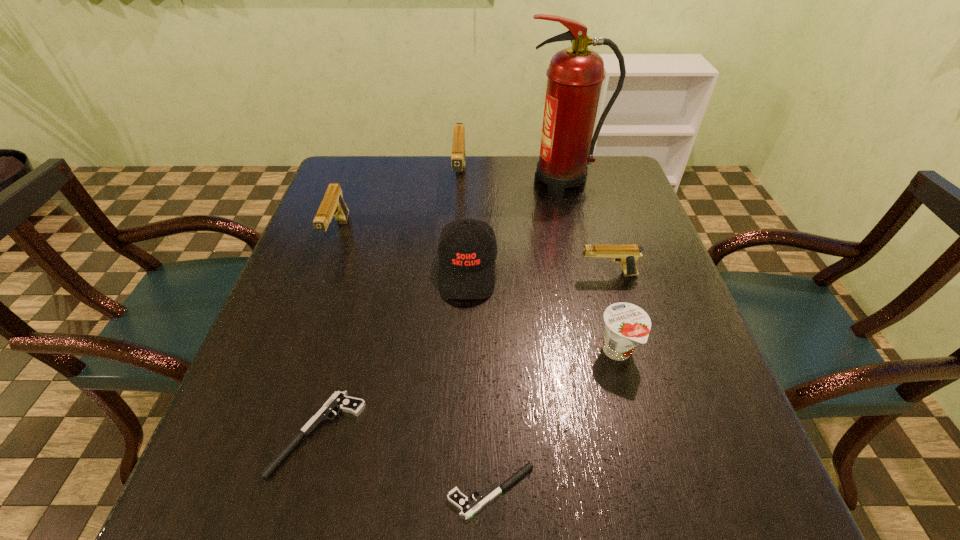
Where is `the second shortest pistol`? This screenshot has width=960, height=540. the second shortest pistol is located at coordinates (x=340, y=401).

Find the location of `the bigger black pistol`. the bigger black pistol is located at coordinates (340, 401).

Where is `the shortest object`? the shortest object is located at coordinates (468, 508).

The width and height of the screenshot is (960, 540). In order to click on the shortest pistol in this screenshot , I will do `click(468, 508)`.

The height and width of the screenshot is (540, 960). What are the coordinates of `free space located 0.140m on the front-facing side of the fire extinguisher` in the screenshot? It's located at (473, 181).

Where is `vacant region located on the front-facing side of the fire extinguisher`? The height and width of the screenshot is (540, 960). vacant region located on the front-facing side of the fire extinguisher is located at coordinates (484, 181).

This screenshot has height=540, width=960. In order to click on free space located on the front-facing side of the fire extinguisher in this screenshot , I will do `click(421, 181)`.

Where is `vacant point located at the barrel of the farthest tan pistol`? The height and width of the screenshot is (540, 960). vacant point located at the barrel of the farthest tan pistol is located at coordinates (453, 304).

Image resolution: width=960 pixels, height=540 pixels. Identify the location of free spot located at the barrel of the leftmost tan pistol. (319, 291).

Locate an element on the screen. free space located on the front-facing side of the baseball cap is located at coordinates [x=461, y=505].